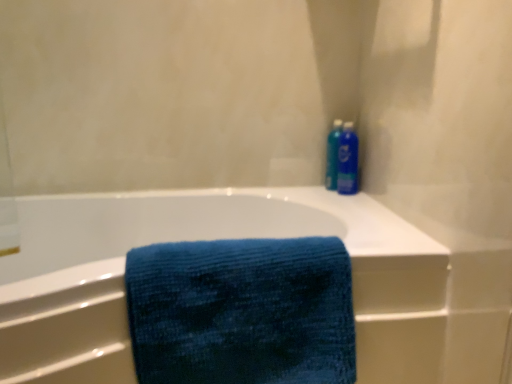
Question: Should I look upward or downward to see blue plastic bottle at upper right?

Choices:
 (A) up
 (B) down

Answer: (A)

Question: Is the depth of blue plastic bottle at upper right greater than that of blue fabric towel at center?

Choices:
 (A) no
 (B) yes

Answer: (B)

Question: From the image's perspective, is blue plastic bottle at upper right over blue fabric towel at center?

Choices:
 (A) no
 (B) yes

Answer: (B)

Question: Is blue plastic bottle at upper right at the left side of blue fabric towel at center?

Choices:
 (A) no
 (B) yes

Answer: (A)

Question: Is blue fabric towel at center inside blue plastic bottle at upper right?

Choices:
 (A) yes
 (B) no

Answer: (B)

Question: Is blue plastic bottle at upper right oriented away from blue fabric towel at center?

Choices:
 (A) yes
 (B) no

Answer: (B)

Question: Is blue plastic bottle at upper right shorter than blue fabric towel at center?

Choices:
 (A) no
 (B) yes

Answer: (B)

Question: Can you confirm if blue textured towel at center is bigger than blue fabric towel at center?

Choices:
 (A) no
 (B) yes

Answer: (A)

Question: Is blue textured towel at center at the right side of blue fabric towel at center?

Choices:
 (A) yes
 (B) no

Answer: (A)

Question: From the image's perspective, is blue textured towel at center on top of blue fabric towel at center?

Choices:
 (A) no
 (B) yes

Answer: (B)

Question: Does blue textured towel at center contain blue fabric towel at center?

Choices:
 (A) no
 (B) yes

Answer: (A)

Question: Considering the relative positions of blue textured towel at center and blue fabric towel at center in the image provided, is blue textured towel at center to the left of blue fabric towel at center from the viewer's perspective?

Choices:
 (A) no
 (B) yes

Answer: (A)

Question: Is blue textured towel at center thinner than blue fabric towel at center?

Choices:
 (A) yes
 (B) no

Answer: (A)

Question: Is blue fabric towel at center oriented towards blue textured towel at center?

Choices:
 (A) yes
 (B) no

Answer: (A)